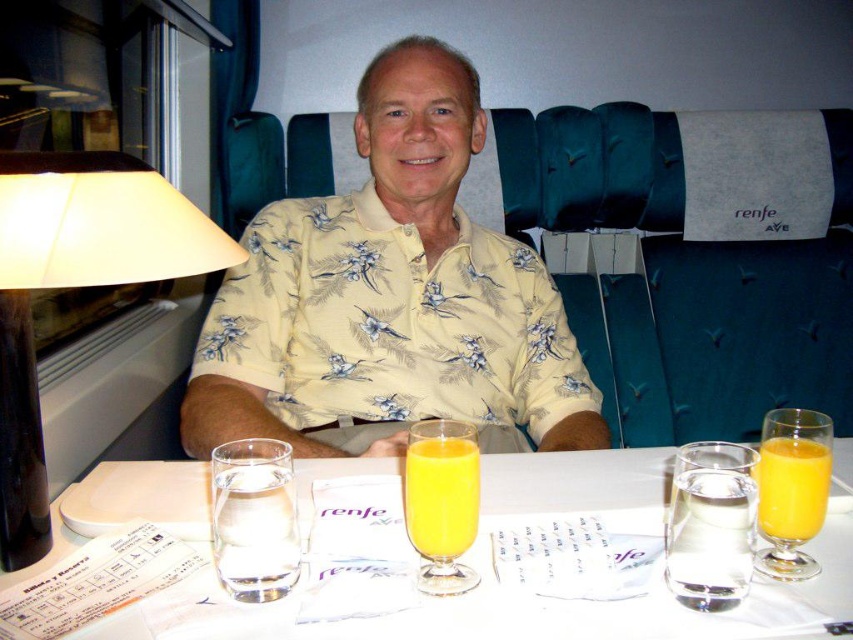
Question: Estimate the real-world distances between objects in this image. Which object is closer to the clear glass water at center?

Choices:
 (A) yellow floral shirt at center
 (B) matte black lampshade at left
 (C) orange liquid at center
 (D) orange liquid at table right

Answer: (C)

Question: Is yellow floral shirt at center to the left of clear glass water at table right from the viewer's perspective?

Choices:
 (A) yes
 (B) no

Answer: (A)

Question: Which object is the farthest from the matte black lampshade at left?

Choices:
 (A) orange liquid at center
 (B) orange liquid at table right
 (C) clear glass water at table right
 (D) yellow floral shirt at center

Answer: (B)

Question: Is yellow floral shirt at center to the left of clear glass water at table right from the viewer's perspective?

Choices:
 (A) yes
 (B) no

Answer: (A)

Question: Which of the following is the closest to the observer?

Choices:
 (A) (701, 540)
 (B) (822, 515)
 (C) (822, 608)
 (D) (410, 432)

Answer: (A)

Question: Can you confirm if yellow floral shirt at center is positioned above orange liquid at center?

Choices:
 (A) yes
 (B) no

Answer: (A)